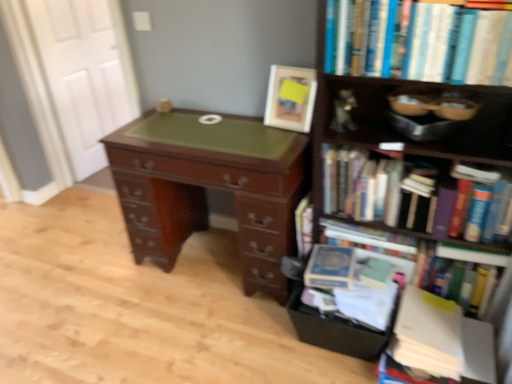
Question: From the image's perspective, is black cardboard drawer at lower right positioned above or below hardcover books at right, the 2th book viewed from the top?

Choices:
 (A) below
 (B) above

Answer: (A)

Question: Relative to hardcover books at right, the 2th book viewed from the top, is black cardboard drawer at lower right in front or behind?

Choices:
 (A) front
 (B) behind

Answer: (B)

Question: Which object is the closest to the hardcover books at upper right, which appears as the 5th book when ordered from the bottom?

Choices:
 (A) white wood door at upper left
 (B) white paper stack at lower right, which appears as the 1th book when ordered from the bottom
 (C) hardcover book at center, the 3th book when ordered from bottom to top
 (D) wooden bookcase at right
 (E) hardcover book at right, which appears as the fourth book when viewed from the top

Answer: (D)

Question: Which of these objects is positioned farthest from the mahogany wood desk at center?

Choices:
 (A) hardcover books at right, the 2th book viewed from the top
 (B) hardcover book at right, positioned as the second book in bottom-to-top order
 (C) blue cardboard magazine at lower right
 (D) hardcover book at center, which ranks as the third book in top-to-bottom order
 (E) wooden bookcase at right

Answer: (B)